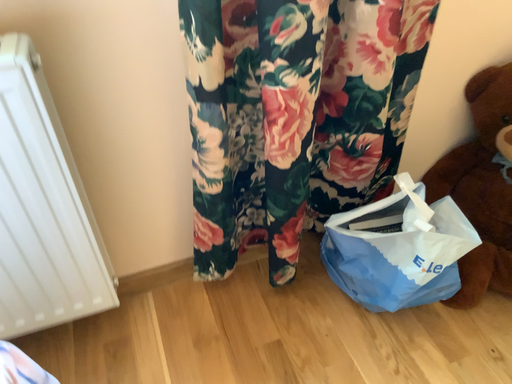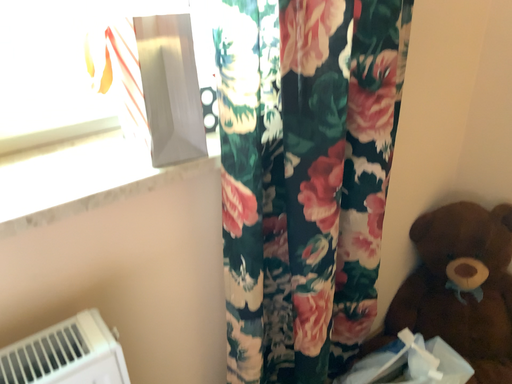
Question: How did the camera likely rotate when shooting the video?

Choices:
 (A) rotated downward
 (B) rotated upward

Answer: (B)